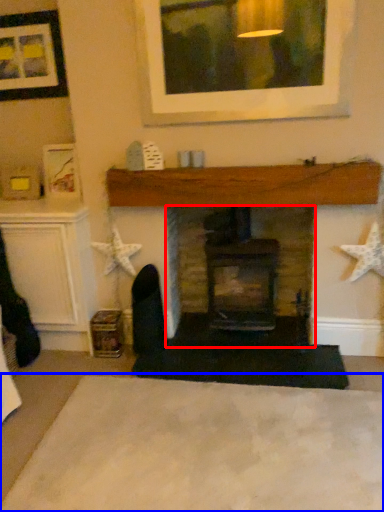
Question: Which point is closer to the camera, fireplace (highlighted by a red box) or plain (highlighted by a blue box)?

Choices:
 (A) fireplace
 (B) plain

Answer: (B)